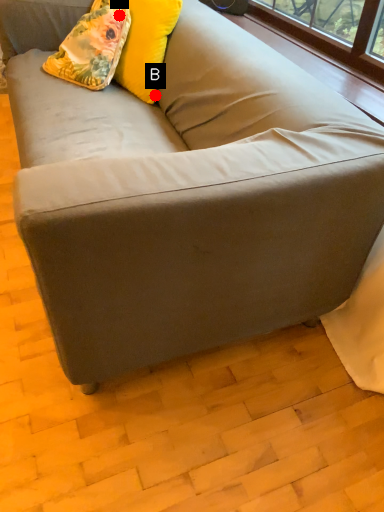
Question: Two points are circled on the image, labeled by A and B beside each circle. Which point is farther from the camera taking this photo?

Choices:
 (A) A is further
 (B) B is further

Answer: (B)